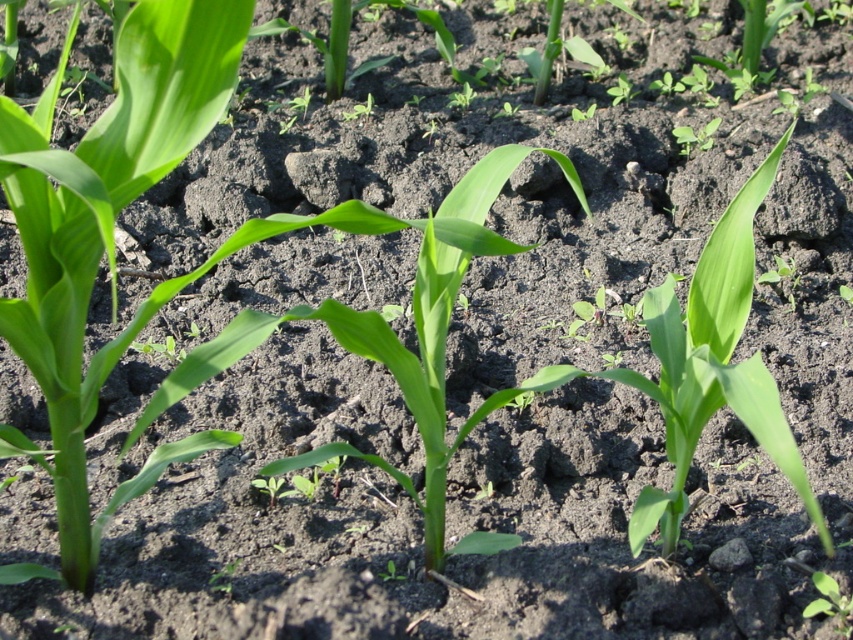
Does green leafy plant at center appear on the right side of green leafy plant at lower right?

No, green leafy plant at center is not to the right of green leafy plant at lower right.

At what (x,y) coordinates should I click in order to perform the action: click on green leafy plant at center. Please return your answer as a coordinate pair (x, y). Looking at the image, I should click on (433, 342).

Which is in front, point (439, 301) or point (828, 605)?

Point (439, 301) is in front.

You are a GUI agent. You are given a task and a screenshot of the screen. Output one action in this format:
    pyautogui.click(x=<x>, y=<y>)
    Task: Click on the green leafy plant at center
    Image resolution: width=853 pixels, height=640 pixels.
    Given the screenshot: What is the action you would take?
    pyautogui.click(x=433, y=342)